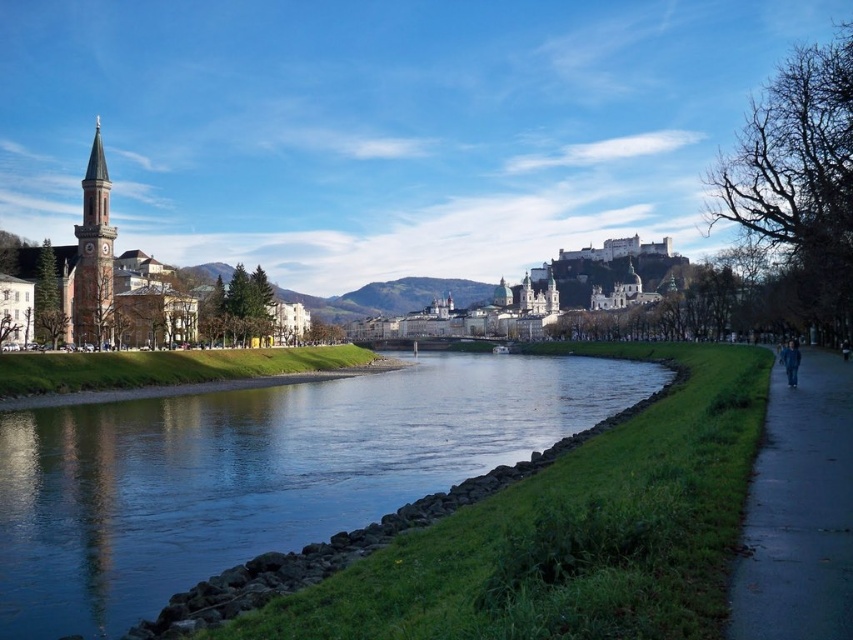
You are a photographer planning to take a photo of the matte red brick clock tower at left and the blue fabric jacket at lower right. Which object should you focus on first if you want to capture both in the same frame without moving the camera?

You should focus on the matte red brick clock tower at left first because it is positioned on the left side of the blue fabric jacket at lower right, so adjusting the framing to include both would require ensuring the tower is within the left portion of the frame before including the jacket on the right.